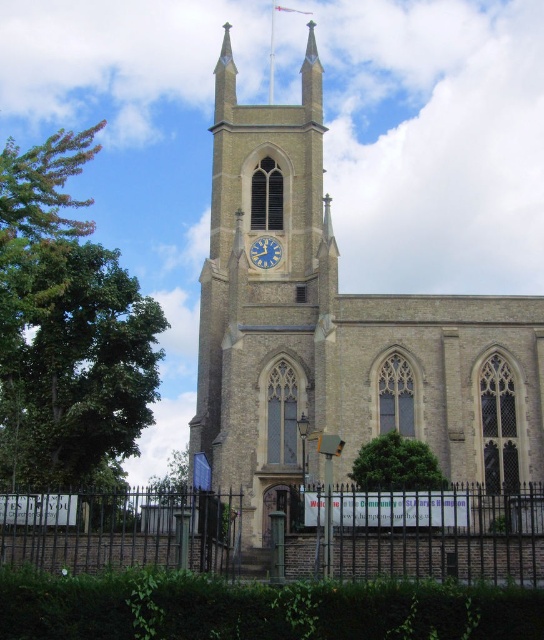
You are standing in front of the church and want to walk through the entrance. There is a black metal fence at lower center and a green leafy tree at center in your way. Which object do you need to move aside to access the church entrance?

The black metal fence at lower center has a larger width than the green leafy tree at center, so you need to move aside the black metal fence at lower center to access the church entrance.

You are standing in front of the church and want to walk towards the point marked by the coordinates point (128, 532). Based on the image, what object will you encounter at that location?

The point (128, 532) marks the black metal fence at lower center, so you will encounter the black metal fence at lower center at that location.

You are a photographer planning to capture the entire structure of the beige stone church at center and the blue metallic clock at center in a single shot. Based on their heights, which one will occupy more vertical space in the photo?

The beige stone church at center is much taller than the blue metallic clock at center, so it will occupy more vertical space in the photo.